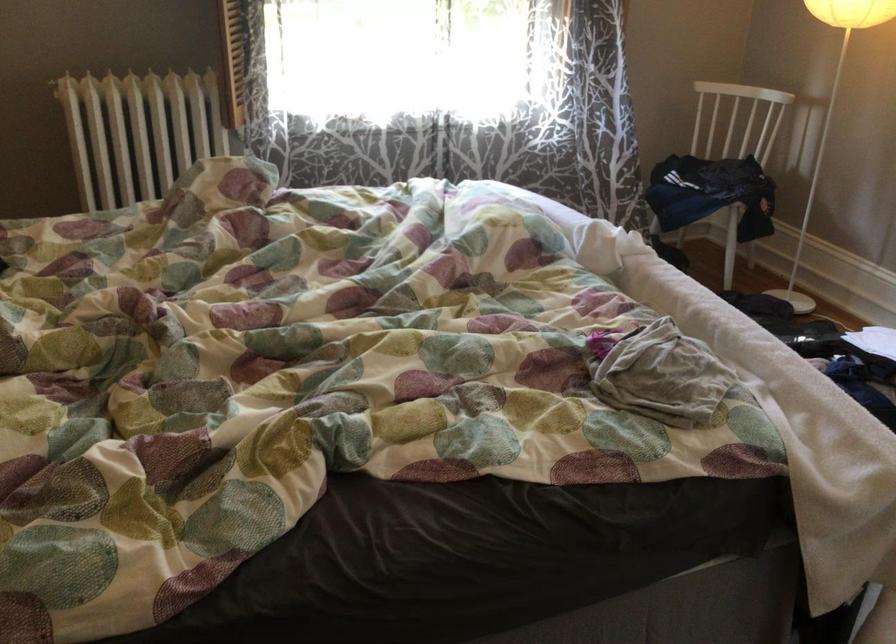
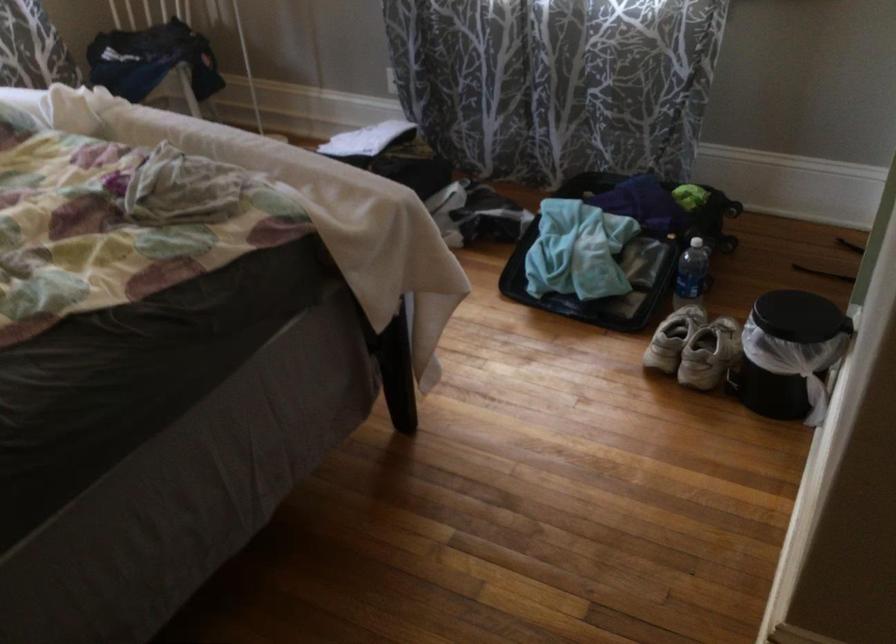
Question: Based on the continuous images, in which direction is the camera rotating? Reply with the corresponding letter.

Choices:
 (A) Left
 (B) Right
 (C) Up
 (D) Down

Answer: (B)